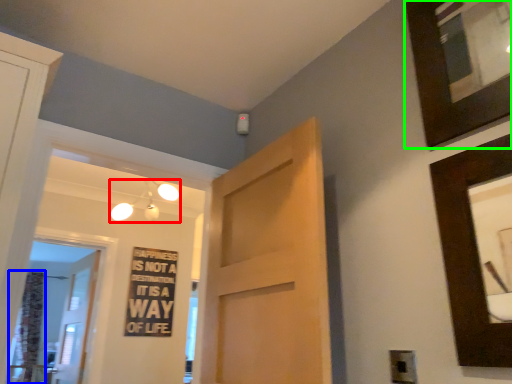
Question: Which object is the farthest from light fixture (highlighted by a red box)? Choose among these: curtain (highlighted by a blue box) or picture frame (highlighted by a green box).

Choices:
 (A) curtain
 (B) picture frame

Answer: (B)